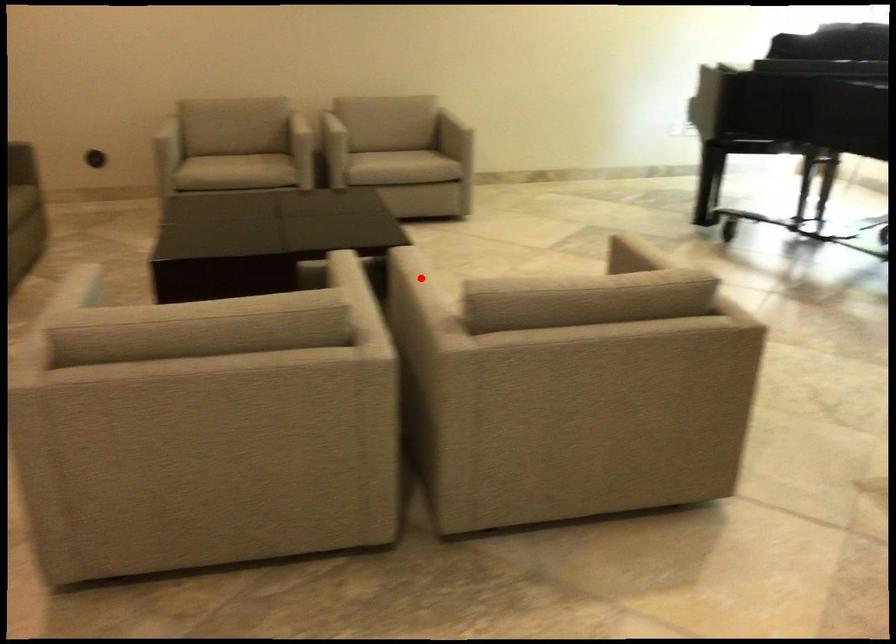
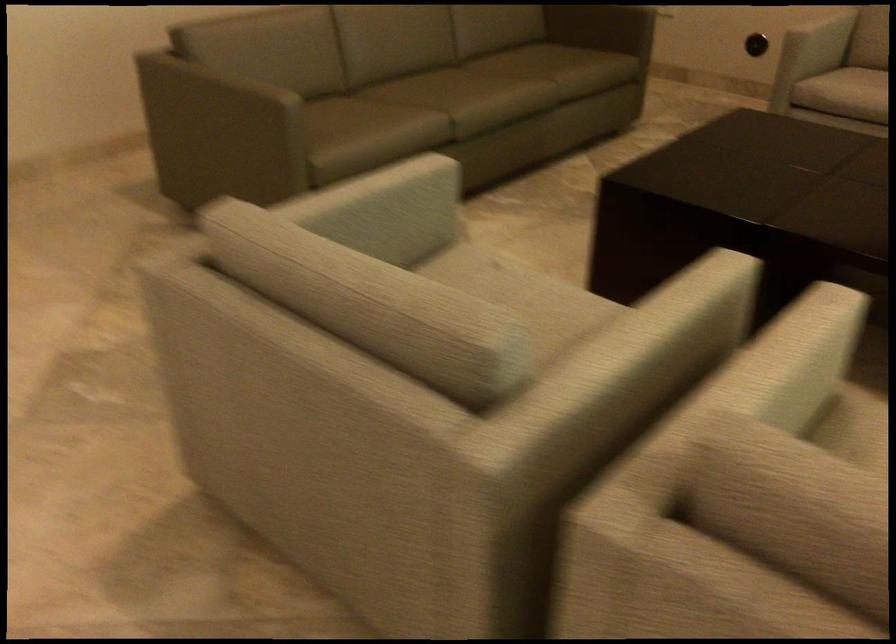
Question: I am providing you with two images of the same scene from different viewpoints. A red point is marked on the first image. At the location where the point appears in image 1, is it still visible in image 2?

Choices:
 (A) Yes
 (B) No

Answer: (A)